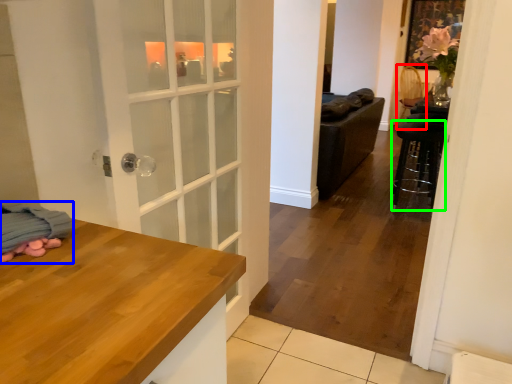
Question: Based on their relative distances, which object is nearer to armchair (highlighted by a red box)? Choose from blanket (highlighted by a blue box) and bar stool (highlighted by a green box).

Choices:
 (A) blanket
 (B) bar stool

Answer: (B)